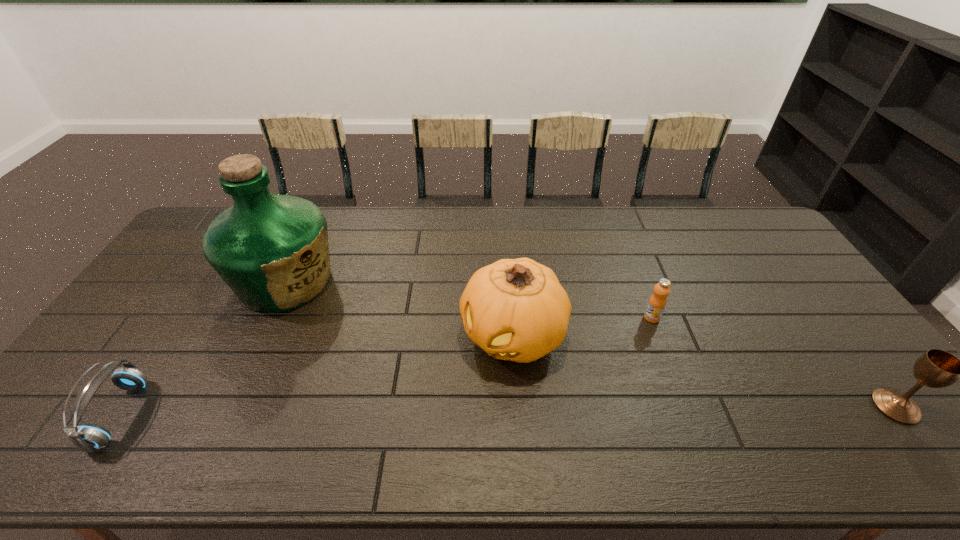
Where is `vacant space located on the front label of the second object from right to left`? The width and height of the screenshot is (960, 540). vacant space located on the front label of the second object from right to left is located at coordinates (591, 370).

In order to click on vacant region located 0.050m on the front label of the second object from right to left in this screenshot , I will do `click(637, 330)`.

I want to click on free space located 0.140m on the front label of the second object from right to left, so click(618, 347).

You are a GUI agent. You are given a task and a screenshot of the screen. Output one action in this format:
    pyautogui.click(x=<x>, y=<y>)
    Task: Click on the free spot located on the label side of the fourth object from right to left
    
    Given the screenshot: What is the action you would take?
    pyautogui.click(x=385, y=353)

Locate an element on the screen. This screenshot has height=540, width=960. free region located on the label side of the fourth object from right to left is located at coordinates (370, 342).

You are a GUI agent. You are given a task and a screenshot of the screen. Output one action in this format:
    pyautogui.click(x=<x>, y=<y>)
    Task: Click on the vacant space located on the label side of the fourth object from right to left
    This screenshot has width=960, height=540.
    Given the screenshot: What is the action you would take?
    pyautogui.click(x=336, y=318)

In order to click on vacant space situated 0.170m on the front face of the second tallest object in this screenshot , I will do `click(433, 412)`.

You are a GUI agent. You are given a task and a screenshot of the screen. Output one action in this format:
    pyautogui.click(x=<x>, y=<y>)
    Task: Click on the vacant region located 0.060m on the front face of the second tallest object
    
    Given the screenshot: What is the action you would take?
    pyautogui.click(x=464, y=383)

This screenshot has height=540, width=960. In order to click on headset positioned at the near edge in this screenshot , I will do `click(87, 437)`.

Where is `chalice present at the near edge`? Image resolution: width=960 pixels, height=540 pixels. chalice present at the near edge is located at coordinates (936, 368).